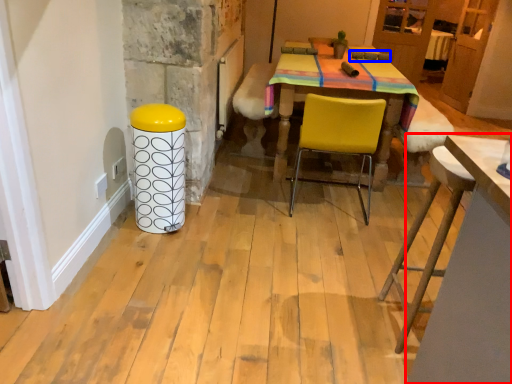
Question: Which object is further to the camera taking this photo, table (highlighted by a red box) or armchair (highlighted by a blue box)?

Choices:
 (A) table
 (B) armchair

Answer: (B)